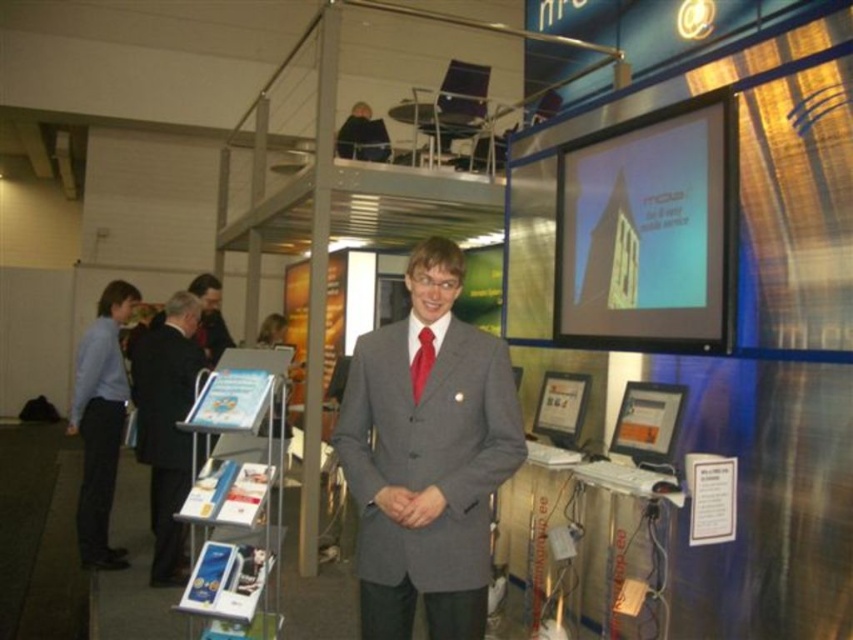
Question: Is blue fabric shirt at left to the right of red satin tie at center from the viewer's perspective?

Choices:
 (A) no
 (B) yes

Answer: (A)

Question: Among these objects, which one is farthest from the camera?

Choices:
 (A) gray wool suit at center
 (B) red satin tie at center

Answer: (B)

Question: Among these points, which one is farthest from the camera?

Choices:
 (A) (408, 397)
 (B) (88, 428)

Answer: (B)

Question: Is gray wool suit at center further to camera compared to red satin tie at center?

Choices:
 (A) yes
 (B) no

Answer: (B)

Question: Does gray wool suit at center have a larger size compared to red satin tie at center?

Choices:
 (A) no
 (B) yes

Answer: (B)

Question: Which object is positioned closest to the dark gray suit at center?

Choices:
 (A) red satin tie at center
 (B) blue fabric shirt at left

Answer: (B)